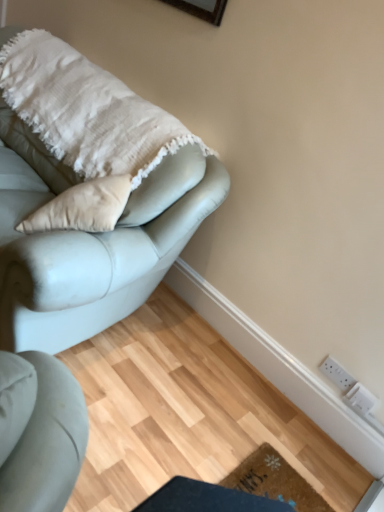
Question: From a real-world perspective, is brown textured mat at lower center physically located above or below white textured blanket at upper left?

Choices:
 (A) above
 (B) below

Answer: (B)

Question: Visually, is brown textured mat at lower center positioned to the left or to the right of white textured blanket at upper left?

Choices:
 (A) left
 (B) right

Answer: (B)

Question: Which object is positioned closest to the satin light blue couch at upper left?

Choices:
 (A) white plastic electric outlet at lower right, arranged as the 1th electric outlet when ordered from the bottom
 (B) white plastic socket at lower right, which is the first electric outlet in top-to-bottom order
 (C) brown textured mat at lower center
 (D) white textured blanket at upper left

Answer: (D)

Question: Based on their relative distances, which object is nearer to the white plastic socket at lower right, the 2th electric outlet from the bottom?

Choices:
 (A) brown textured mat at lower center
 (B) white textured blanket at upper left
 (C) satin light blue couch at upper left
 (D) white plastic electric outlet at lower right, arranged as the 1th electric outlet when ordered from the bottom

Answer: (D)